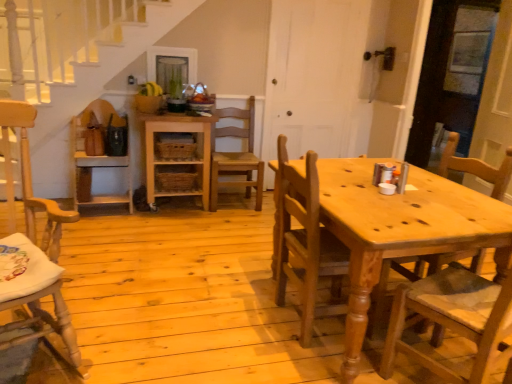
Identify the location of free space to the back side of light brown wood chair at left, which is counted as the fourth chair, starting from the right. (109, 291).